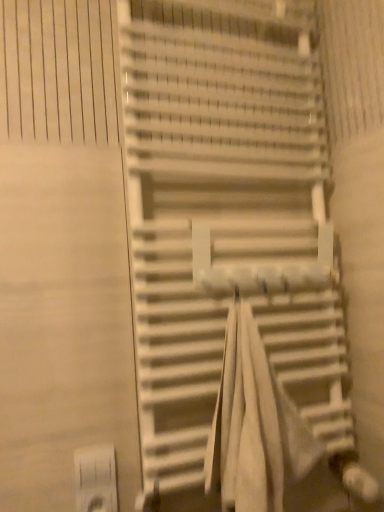
Question: Considering the positions of point (172, 378) and point (89, 483), is point (172, 378) closer or farther from the camera than point (89, 483)?

Choices:
 (A) farther
 (B) closer

Answer: (B)

Question: Considering the positions of white matte stairs at center and white plastic electric outlet at lower left in the image, is white matte stairs at center taller or shorter than white plastic electric outlet at lower left?

Choices:
 (A) tall
 (B) short

Answer: (A)

Question: Estimate the real-world distances between objects in this image. Which object is farther from the white plastic electric outlet at lower left?

Choices:
 (A) white fabric beach towel at center
 (B) white matte stairs at center

Answer: (B)

Question: Which of these objects is positioned farthest from the white matte stairs at center?

Choices:
 (A) white fabric beach towel at center
 (B) white plastic electric outlet at lower left

Answer: (B)